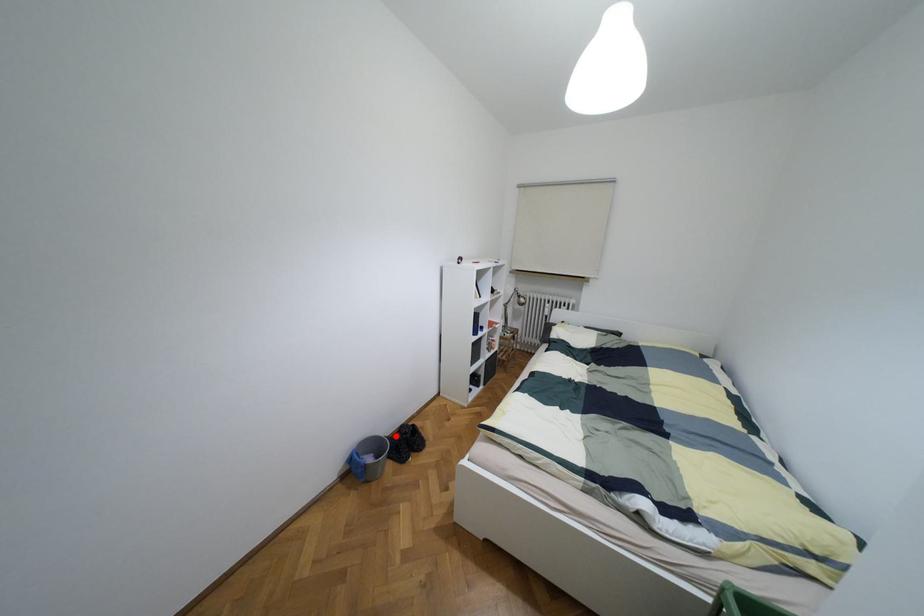
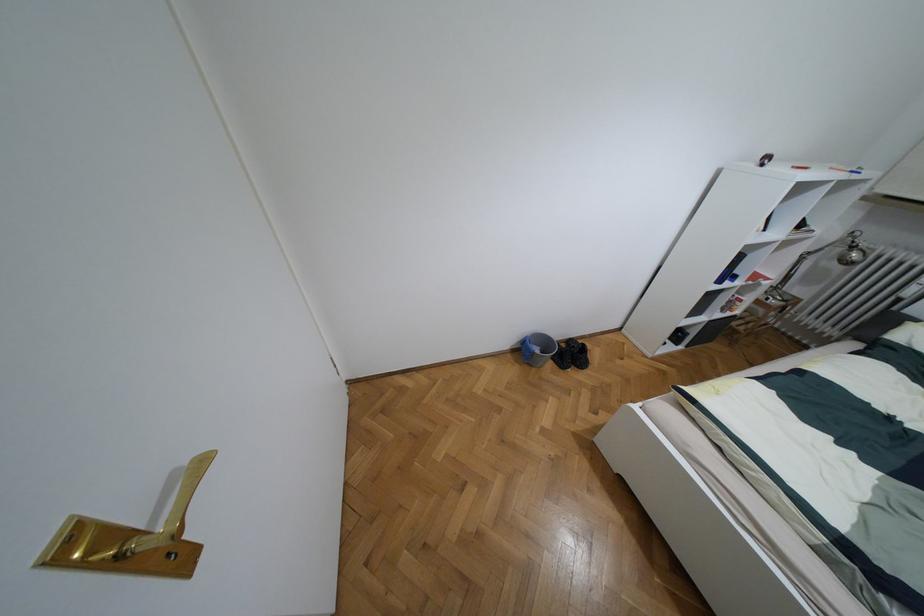
In the second image, find the point that corresponds to the highlighted location in the first image.

(563, 345)